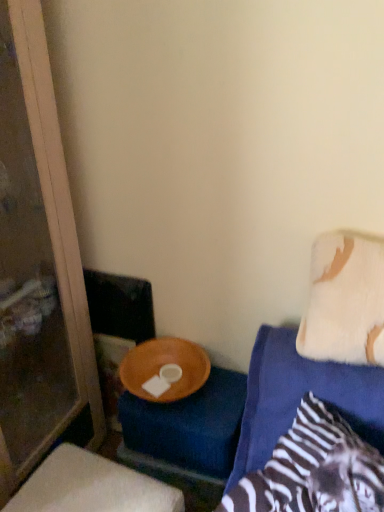
Question: From the image's perspective, does white fluffy pillow at upper right appear lower than transparent glass screen door at left?

Choices:
 (A) yes
 (B) no

Answer: (B)

Question: From the image's perspective, is white fluffy pillow at upper right located above transparent glass screen door at left?

Choices:
 (A) yes
 (B) no

Answer: (A)

Question: Does white fluffy pillow at upper right have a lesser height compared to transparent glass screen door at left?

Choices:
 (A) no
 (B) yes

Answer: (B)

Question: Can you confirm if white fluffy pillow at upper right is thinner than transparent glass screen door at left?

Choices:
 (A) no
 (B) yes

Answer: (B)

Question: Can you confirm if white fluffy pillow at upper right is wider than transparent glass screen door at left?

Choices:
 (A) yes
 (B) no

Answer: (B)

Question: Looking at their shapes, would you say transparent glass screen door at left is wider or thinner than wooden bowl at lower center?

Choices:
 (A) thin
 (B) wide

Answer: (B)

Question: Looking at the image, does transparent glass screen door at left seem bigger or smaller compared to wooden bowl at lower center?

Choices:
 (A) big
 (B) small

Answer: (A)

Question: Would you say transparent glass screen door at left is to the left or to the right of wooden bowl at lower center in the picture?

Choices:
 (A) left
 (B) right

Answer: (A)

Question: Is point (19, 251) closer or farther from the camera than point (59, 502)?

Choices:
 (A) closer
 (B) farther

Answer: (B)

Question: In the image, is white fluffy pillow at upper right positioned in front of or behind wooden bowl at lower center?

Choices:
 (A) behind
 (B) front

Answer: (B)

Question: In terms of size, does white fluffy pillow at upper right appear bigger or smaller than wooden bowl at lower center?

Choices:
 (A) big
 (B) small

Answer: (B)

Question: From the image's perspective, is white fluffy pillow at upper right above or below wooden bowl at lower center?

Choices:
 (A) below
 (B) above

Answer: (B)

Question: From a real-world perspective, is white fluffy pillow at upper right above or below wooden bowl at lower center?

Choices:
 (A) above
 (B) below

Answer: (A)

Question: Considering the positions of white fluffy pillow at upper right and transparent glass screen door at left in the image, is white fluffy pillow at upper right wider or thinner than transparent glass screen door at left?

Choices:
 (A) wide
 (B) thin

Answer: (B)

Question: In the image, is white fluffy pillow at upper right positioned in front of or behind transparent glass screen door at left?

Choices:
 (A) behind
 (B) front

Answer: (A)